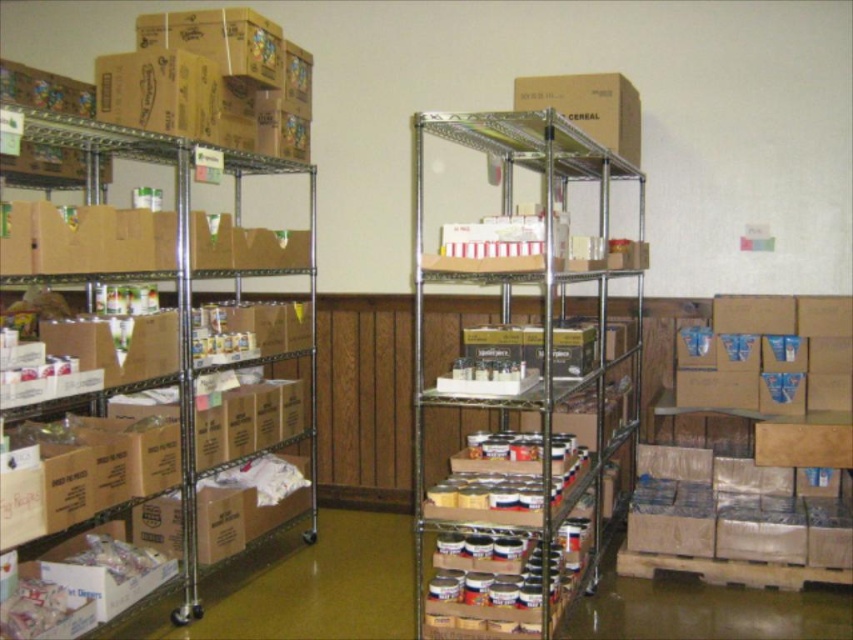
Question: Does brown cardboard boxes at lower right come in front of brown cardboard boxes at left?

Choices:
 (A) no
 (B) yes

Answer: (A)

Question: Estimate the real-world distances between objects in this image. Which object is closer to the brown cardboard boxes at lower right?

Choices:
 (A) brown cardboard boxes at left
 (B) metallic silver shelves at center
 (C) cardboard box at center

Answer: (B)

Question: Based on their relative distances, which object is farther from the cardboard box at center?

Choices:
 (A) brown cardboard boxes at left
 (B) metallic silver shelves at center

Answer: (A)

Question: Which object is positioned farthest from the metallic silver shelves at center?

Choices:
 (A) cardboard box at center
 (B) brown cardboard boxes at lower right
 (C) brown cardboard boxes at left

Answer: (C)

Question: From the image, what is the correct spatial relationship of brown cardboard boxes at lower right in relation to cardboard box at center?

Choices:
 (A) left
 (B) right

Answer: (B)

Question: Is metallic silver shelves at center smaller than brown cardboard boxes at lower right?

Choices:
 (A) yes
 (B) no

Answer: (B)